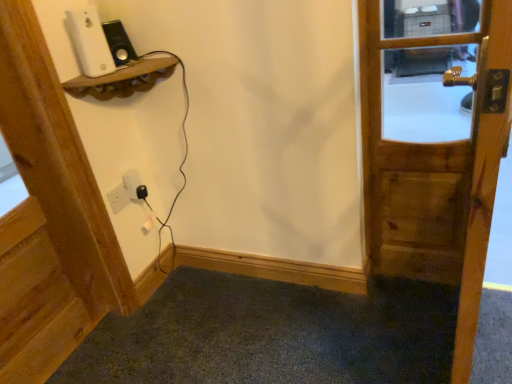
Question: From the image's perspective, is black plastic plug at lower center under white matte ipod at upper left?

Choices:
 (A) no
 (B) yes

Answer: (B)

Question: Can we say black plastic plug at lower center lies outside white matte ipod at upper left?

Choices:
 (A) no
 (B) yes

Answer: (B)

Question: Is white matte ipod at upper left inside black plastic plug at lower center?

Choices:
 (A) yes
 (B) no

Answer: (B)

Question: Is black plastic plug at lower center not near white matte ipod at upper left?

Choices:
 (A) no
 (B) yes

Answer: (A)

Question: Is black plastic plug at lower center aimed at white matte ipod at upper left?

Choices:
 (A) yes
 (B) no

Answer: (B)

Question: Is black plastic plug at lower center closer to camera compared to white matte ipod at upper left?

Choices:
 (A) yes
 (B) no

Answer: (B)

Question: Could you tell me if wooden door handle at right, which is the 1th door in right-to-left order, is facing wooden door at upper left, which ranks as the first door in left-to-right order?

Choices:
 (A) yes
 (B) no

Answer: (B)

Question: Considering the relative positions of wooden door handle at right, acting as the second door starting from the left, and wooden door at upper left, which ranks as the first door in left-to-right order, in the image provided, is wooden door handle at right, acting as the second door starting from the left, to the right of wooden door at upper left, which ranks as the first door in left-to-right order, from the viewer's perspective?

Choices:
 (A) yes
 (B) no

Answer: (A)

Question: From the image's perspective, does wooden door handle at right, which is the 1th door in right-to-left order, appear lower than wooden door at upper left, which ranks as the first door in left-to-right order?

Choices:
 (A) no
 (B) yes

Answer: (A)

Question: Is wooden door handle at right, which is the 1th door in right-to-left order, oriented away from wooden door at upper left, arranged as the 2th door when viewed from the right?

Choices:
 (A) no
 (B) yes

Answer: (B)

Question: Is wooden door handle at right, which is the 1th door in right-to-left order, thinner than wooden door at upper left, which ranks as the first door in left-to-right order?

Choices:
 (A) yes
 (B) no

Answer: (A)

Question: Are wooden door handle at right, which is the 1th door in right-to-left order, and wooden door at upper left, which ranks as the first door in left-to-right order, beside each other?

Choices:
 (A) no
 (B) yes

Answer: (A)

Question: Can you confirm if wooden door at upper left, which ranks as the first door in left-to-right order, is thinner than black plastic plug at lower center?

Choices:
 (A) no
 (B) yes

Answer: (A)